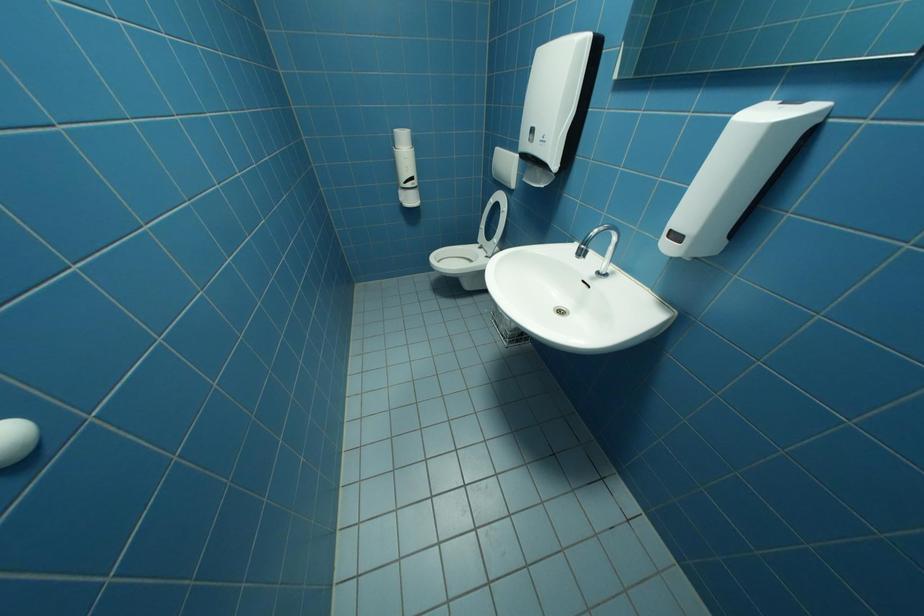
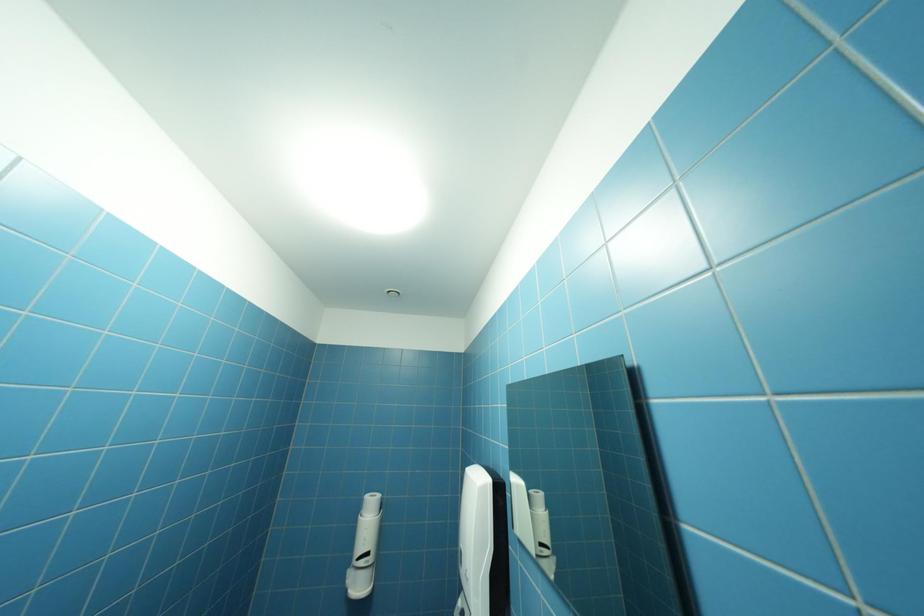
How did the camera likely rotate?

The camera's rotation is toward left-up.